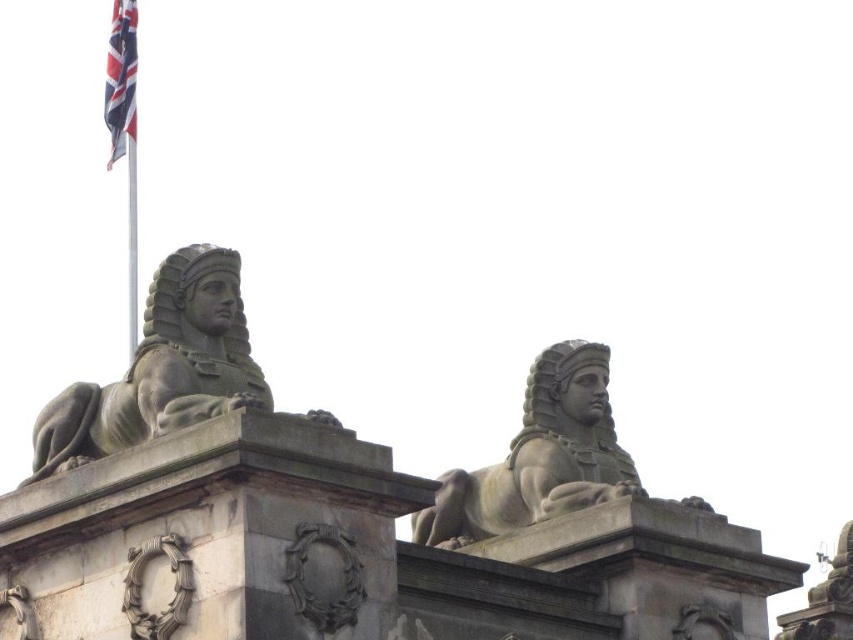
Question: Is carved stone wreath at center closer to the viewer compared to union jack fabric at upper left?

Choices:
 (A) no
 (B) yes

Answer: (B)

Question: Can you confirm if matte stone sphinx at upper left is smaller than carved stone wreath at center?

Choices:
 (A) yes
 (B) no

Answer: (B)

Question: Is carved stone wreath at center behind union jack fabric at upper left?

Choices:
 (A) no
 (B) yes

Answer: (A)

Question: Considering the real-world distances, which object is farthest from the carved stone wreath at center?

Choices:
 (A) union jack fabric at upper left
 (B) matte stone sphinx at upper left

Answer: (A)

Question: Which point is farther to the camera?

Choices:
 (A) (38, 433)
 (B) (117, 81)
 (C) (166, 628)

Answer: (B)

Question: Which of these objects is positioned closest to the carved stone wreath at center?

Choices:
 (A) matte stone sphinx at upper left
 (B) union jack fabric at upper left

Answer: (A)